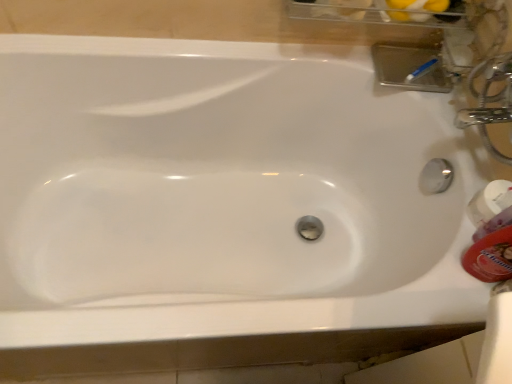
Question: Is orange plastic mouthwash at right, the first mouthwash viewed from the front, smaller than white glossy mouthwash at right, acting as the second mouthwash starting from the front?

Choices:
 (A) yes
 (B) no

Answer: (B)

Question: Is orange plastic mouthwash at right, the first mouthwash viewed from the front, turned away from white glossy mouthwash at right, acting as the second mouthwash starting from the front?

Choices:
 (A) yes
 (B) no

Answer: (B)

Question: Is white glossy mouthwash at right, the first mouthwash positioned from the back, surrounded by orange plastic mouthwash at right, the first mouthwash viewed from the front?

Choices:
 (A) no
 (B) yes

Answer: (A)

Question: From the image's perspective, is orange plastic mouthwash at right, acting as the second mouthwash starting from the back, located above white glossy mouthwash at right, acting as the second mouthwash starting from the front?

Choices:
 (A) yes
 (B) no

Answer: (B)

Question: Is orange plastic mouthwash at right, acting as the second mouthwash starting from the back, positioned far away from white glossy mouthwash at right, the first mouthwash positioned from the back?

Choices:
 (A) no
 (B) yes

Answer: (A)

Question: Is the surface of orange plastic mouthwash at right, acting as the second mouthwash starting from the back, in direct contact with white glossy mouthwash at right, acting as the second mouthwash starting from the front?

Choices:
 (A) yes
 (B) no

Answer: (A)

Question: Does white glossy mouthwash at right, the first mouthwash positioned from the back, lie behind orange plastic mouthwash at right, the first mouthwash viewed from the front?

Choices:
 (A) no
 (B) yes

Answer: (B)

Question: Can you confirm if white glossy mouthwash at right, the first mouthwash positioned from the back, is taller than orange plastic mouthwash at right, acting as the second mouthwash starting from the back?

Choices:
 (A) yes
 (B) no

Answer: (B)

Question: Is the surface of white glossy mouthwash at right, the first mouthwash positioned from the back, in direct contact with orange plastic mouthwash at right, the first mouthwash viewed from the front?

Choices:
 (A) no
 (B) yes

Answer: (B)

Question: Is white glossy mouthwash at right, acting as the second mouthwash starting from the front, outside of orange plastic mouthwash at right, the first mouthwash viewed from the front?

Choices:
 (A) no
 (B) yes

Answer: (B)

Question: From the image's perspective, would you say white glossy mouthwash at right, the first mouthwash positioned from the back, is positioned over orange plastic mouthwash at right, the first mouthwash viewed from the front?

Choices:
 (A) yes
 (B) no

Answer: (A)

Question: From the image's perspective, is white glossy mouthwash at right, acting as the second mouthwash starting from the front, above or below orange plastic mouthwash at right, the first mouthwash viewed from the front?

Choices:
 (A) below
 (B) above

Answer: (B)